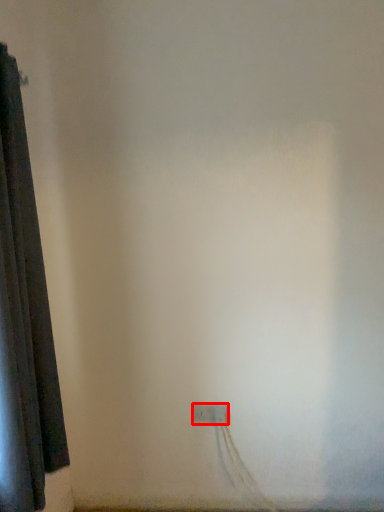
Question: Where is power plugs and sockets (annotated by the red box) located in relation to curtain in the image?

Choices:
 (A) left
 (B) right

Answer: (B)